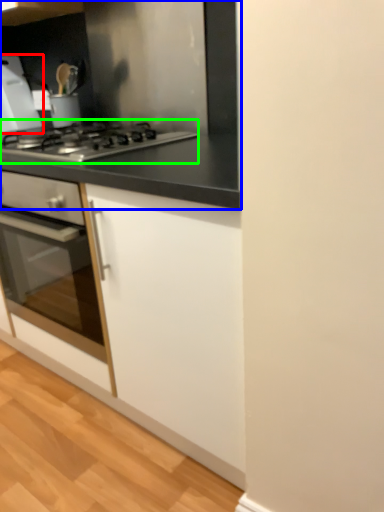
Question: Which object is positioned farthest from home appliance (highlighted by a red box)? Select from countertop (highlighted by a blue box) and gas stove (highlighted by a green box).

Choices:
 (A) countertop
 (B) gas stove

Answer: (B)